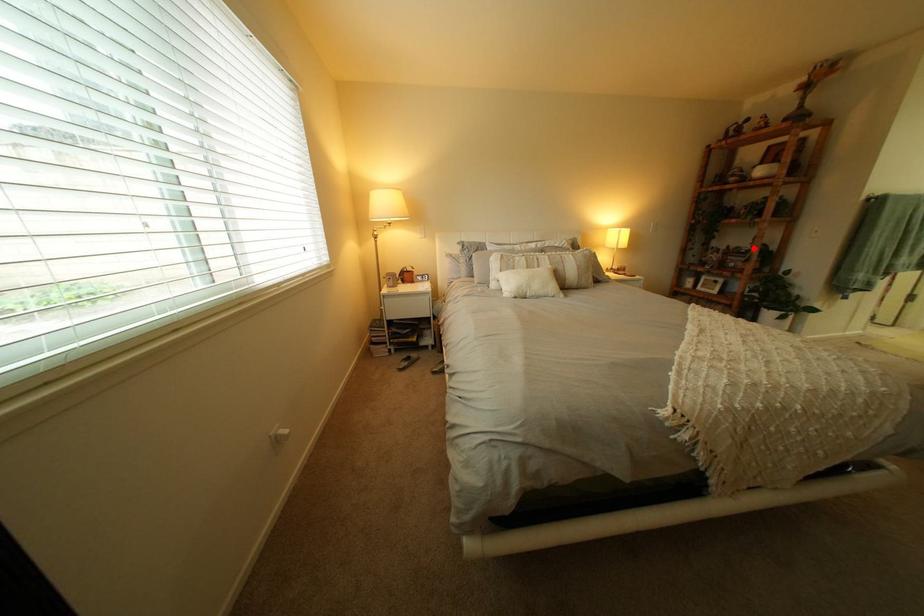
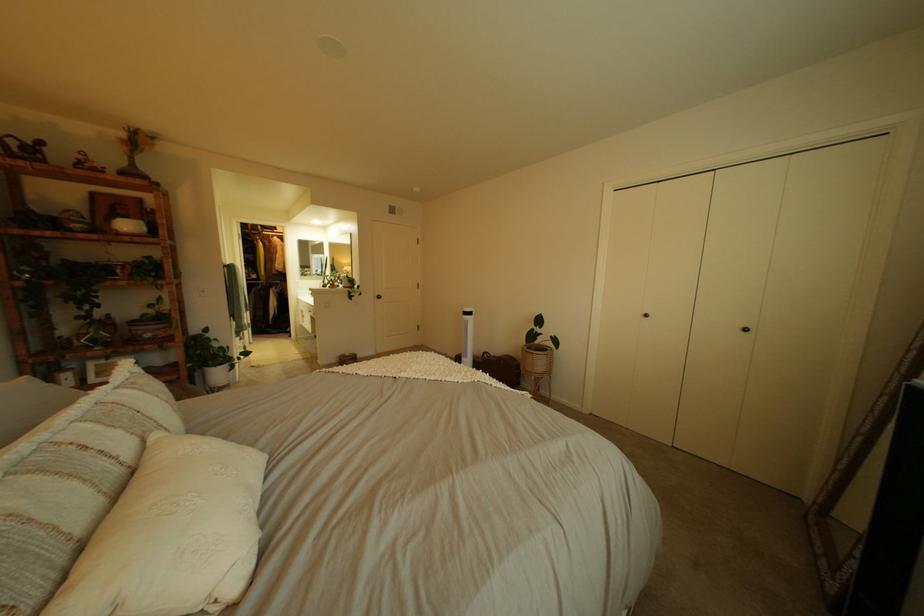
Where in the second image is the point corresponding to the highlighted location from the first image?

(161, 315)